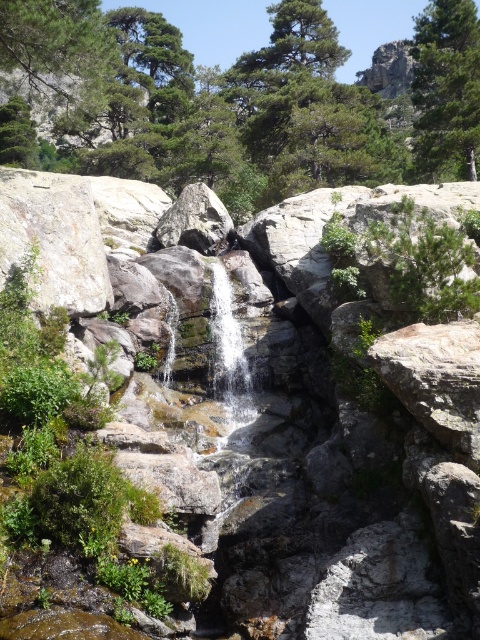
Question: Estimate the real-world distances between objects in this image. Which object is farther from the smooth gray rock at center?

Choices:
 (A) green leafy tree at upper center
 (B) clear water at center

Answer: (A)

Question: Which point is closer to the camera?

Choices:
 (A) (x=3, y=420)
 (B) (x=450, y=150)
 (C) (x=224, y=401)

Answer: (A)

Question: Does smooth gray rock at center have a larger size compared to clear water at center?

Choices:
 (A) no
 (B) yes

Answer: (B)

Question: Where is smooth gray rock at center located in relation to clear water at center in the image?

Choices:
 (A) right
 (B) left

Answer: (A)

Question: Which object is farther from the camera taking this photo?

Choices:
 (A) green leafy tree at upper center
 (B) clear water at center

Answer: (A)

Question: Observing the image, what is the correct spatial positioning of smooth gray rock at center in reference to green leafy tree at upper center?

Choices:
 (A) right
 (B) left

Answer: (B)